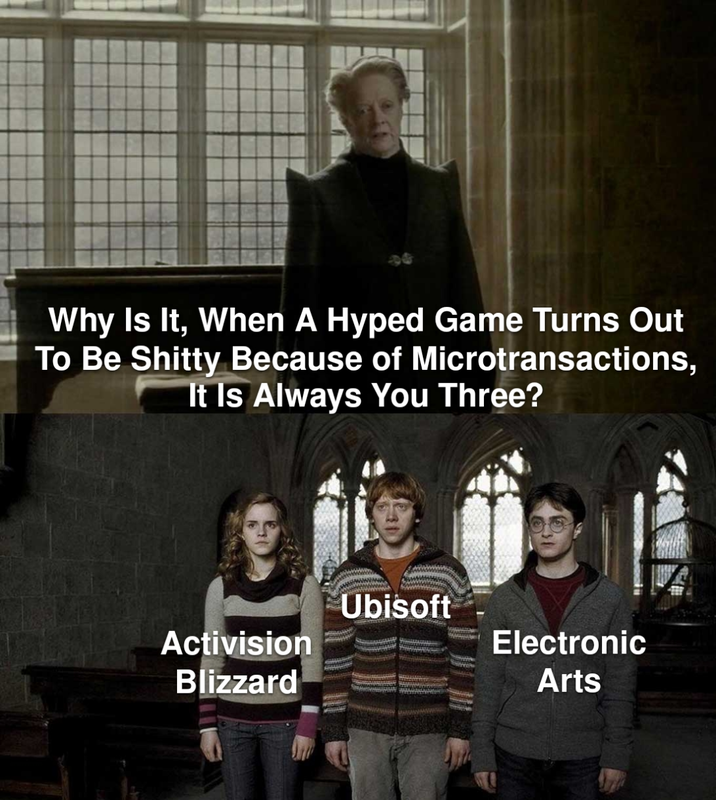
Identify the location of window. This screenshot has height=800, width=716. (488, 526), (336, 532), (667, 510), (238, 104), (134, 126), (31, 146), (412, 114).